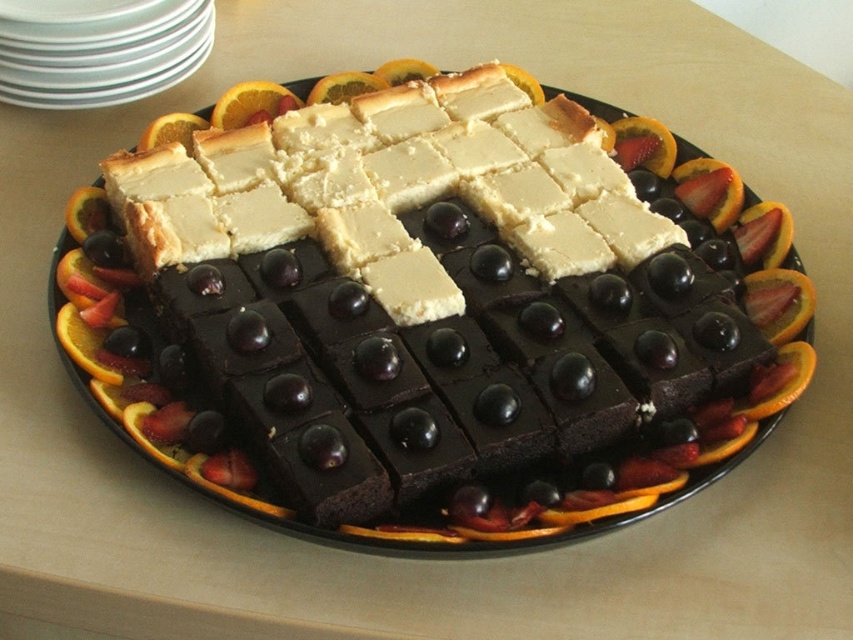
Question: Is smooth chocolate cake at center behind orangesmoothfruit at upper left?

Choices:
 (A) no
 (B) yes

Answer: (A)

Question: Which is nearer to the orange peel at upper left?

Choices:
 (A) smooth chocolate cake at center
 (B) white glossy plates at upper left
 (C) orangesmoothfruit at upper left
 (D) white crumbly cheese at center

Answer: (C)

Question: Estimate the real-world distances between objects in this image. Which object is farther from the smooth chocolate cake at center?

Choices:
 (A) orangesmoothfruit at upper left
 (B) white glossy plates at upper left
 (C) orange peel at upper left

Answer: (C)

Question: Is smooth chocolate cake at center bigger than white crumbly cheese at center?

Choices:
 (A) no
 (B) yes

Answer: (B)

Question: Where is white glossy plates at upper left located in relation to orange peel at upper left in the image?

Choices:
 (A) left
 (B) right

Answer: (A)

Question: Estimate the real-world distances between objects in this image. Which object is farther from the orange peel at upper left?

Choices:
 (A) white crumbly cheese at center
 (B) white glossy plates at upper left
 (C) smooth chocolate cake at center

Answer: (C)